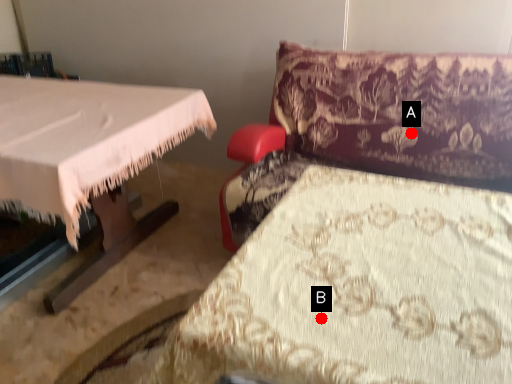
Question: Two points are circled on the image, labeled by A and B beside each circle. Which point appears closest to the camera in this image?

Choices:
 (A) A is closer
 (B) B is closer

Answer: (B)